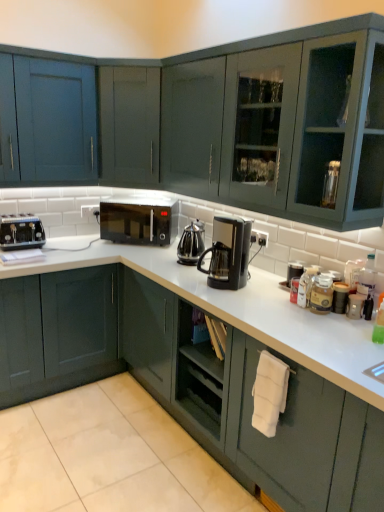
I want to click on free space in front of metallic silver canister at right, so (359, 329).